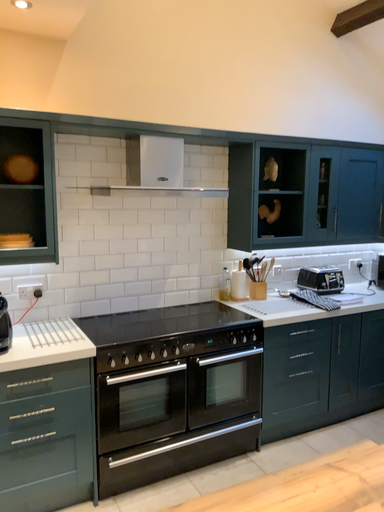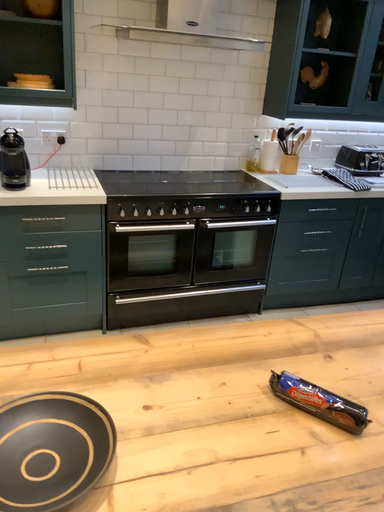
Question: How did the camera likely rotate when shooting the video?

Choices:
 (A) rotated downward
 (B) rotated upward

Answer: (A)